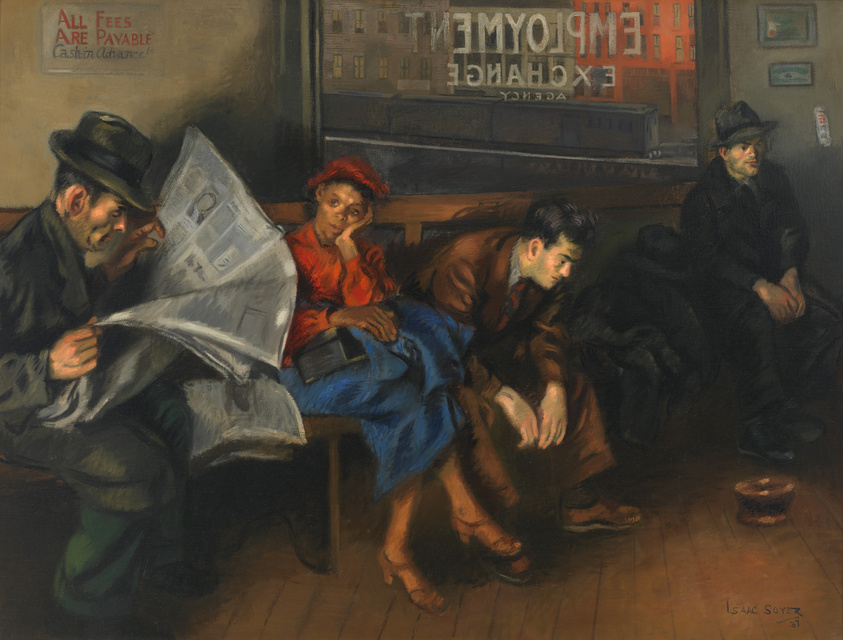
Locate an element on the screen. The height and width of the screenshot is (640, 843). painting is located at coordinates (427, 288).